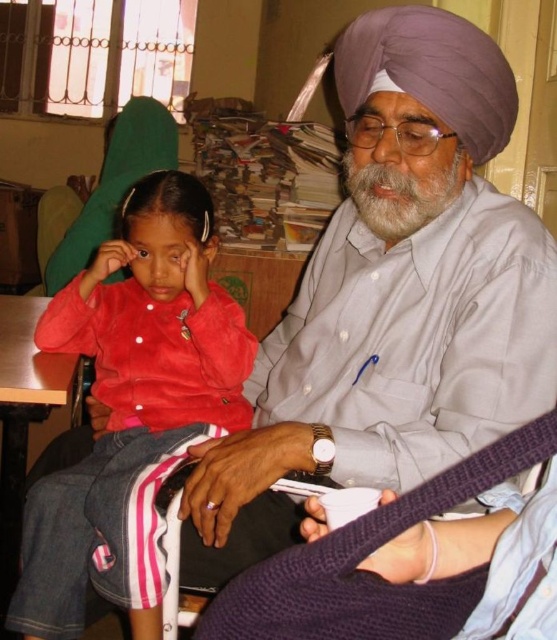
You are a social worker who needs to ensure the safety of the child in the scene. The safety guidelines state that the minimum safe distance between a child and an adult should be at least 60 centimeters. Based on the image, is the current distance between the matte red shirt at left and the purple silk turban at upper center meeting the safety requirement?

The distance between the matte red shirt at left and the purple silk turban at upper center is 58.76 centimeters, which is less than the required 60 centimeters. Therefore, the safety requirement is not being met.

You are a photographer trying to capture a photo of the matte red shirt at left and the purple silk turban at upper center. Which object should you focus on first if you want to ensure both are in focus, considering their heights?

The matte red shirt at left is much taller than the purple silk turban at upper center, so you should focus on the taller object first to ensure both are in focus.